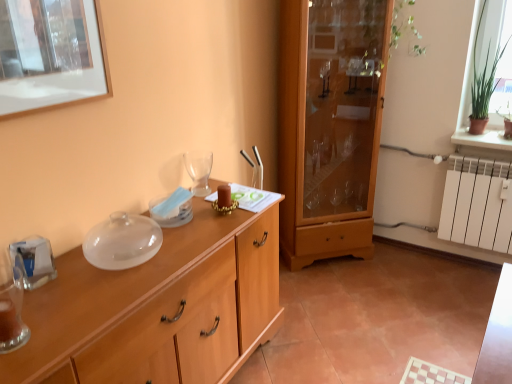
Locate an element on the screen. Image resolution: width=512 pixels, height=384 pixels. free point behind translucent glass vase at left is located at coordinates (46, 298).